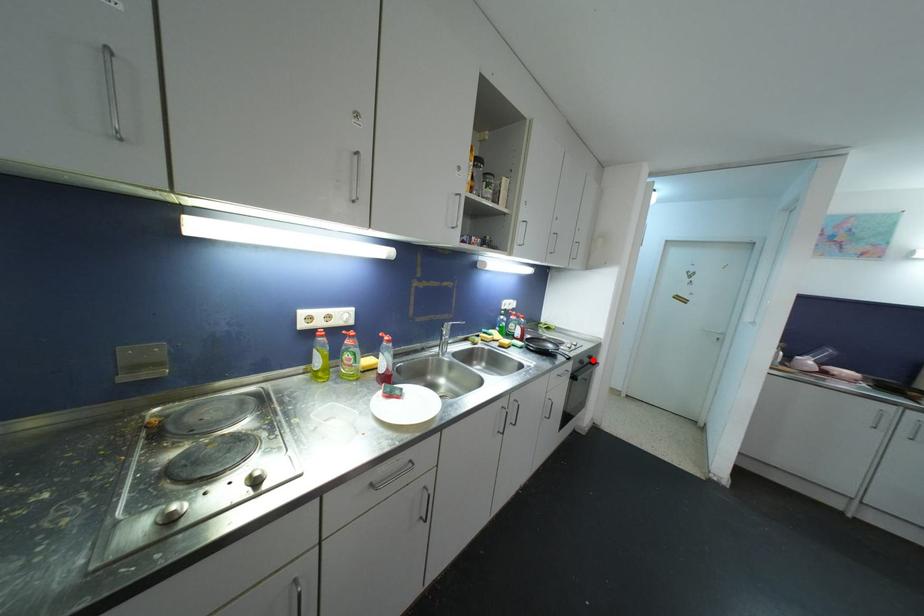
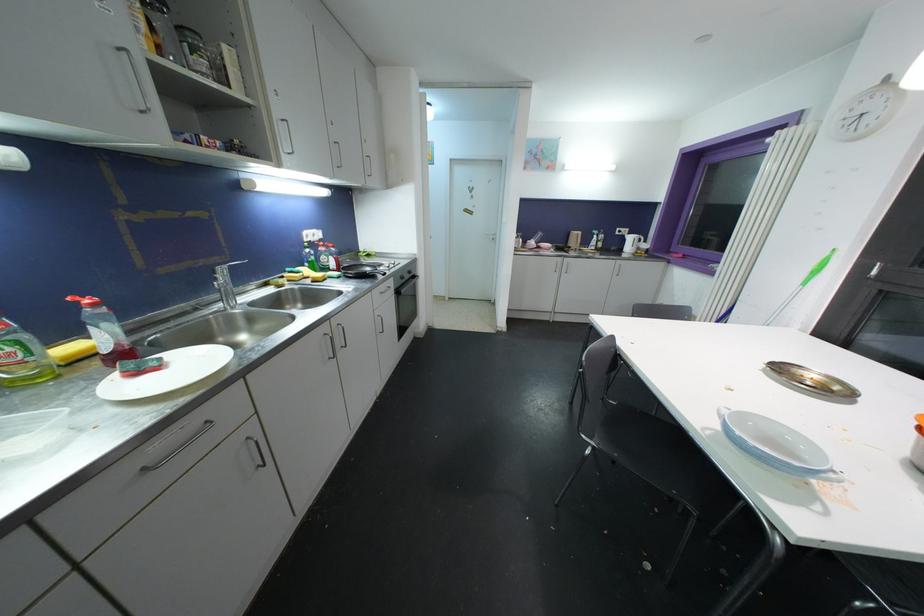
Question: I am providing you with two images of the same scene from different viewpoints. Image1 has a red point marked. In image2, the corresponding 3D location appears at what relative position? Reply with the corresponding letter.

Choices:
 (A) Closer
 (B) Farther

Answer: (A)